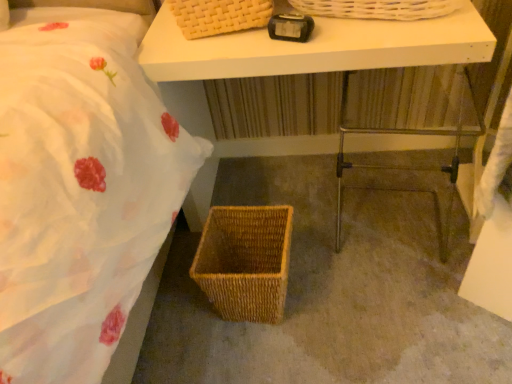
You are a GUI agent. You are given a task and a screenshot of the screen. Output one action in this format:
    pyautogui.click(x=<x>, y=<y>)
    Task: Click on the vacant space situated on the left part of woven brown picnic basket at lower center
    
    Given the screenshot: What is the action you would take?
    pyautogui.click(x=177, y=321)